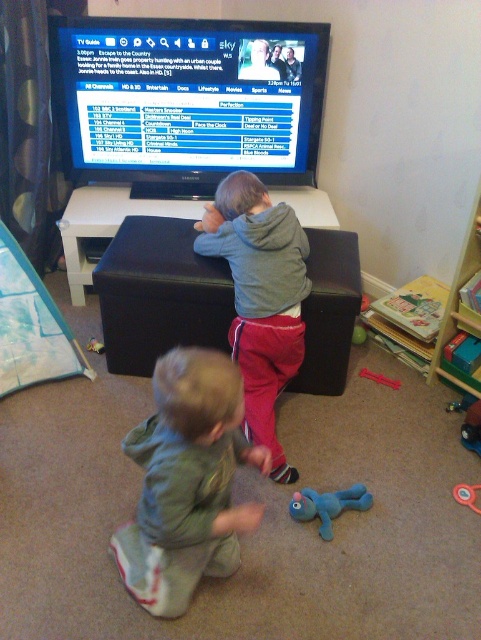
Can you confirm if matte black tv guide at upper center is wider than rubber ring at lower right?

Yes, matte black tv guide at upper center is wider than rubber ring at lower right.

Image resolution: width=481 pixels, height=640 pixels. I want to click on matte black tv guide at upper center, so point(187,100).

Locate an element on the screen. gray fleece hoodie at center is located at coordinates (261, 298).

Who is more distant from viewer, (224,253) or (468,490)?

The point (224,253) is more distant.

I want to click on gray fleece hoodie at center, so click(261, 298).

Looking at this image, which of these two, green soft hoodie at lower center or hardcover books at right, stands taller?

hardcover books at right is taller.

What do you see at coordinates (187, 481) in the screenshot? The width and height of the screenshot is (481, 640). I see `green soft hoodie at lower center` at bounding box center [187, 481].

Is point (192, 573) behind point (431, 380)?

That is False.

This screenshot has width=481, height=640. I want to click on green soft hoodie at lower center, so click(x=187, y=481).